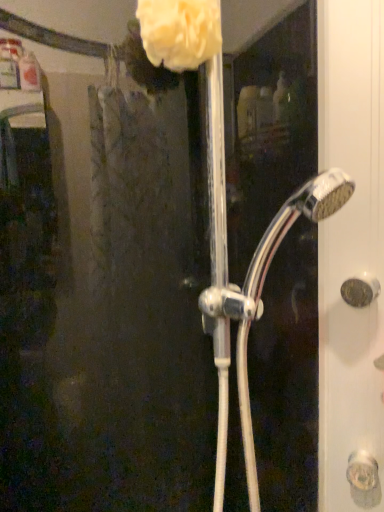
Question: Considering the positions of white fluffy sponge at upper center and matte gold door handle at right in the image, is white fluffy sponge at upper center wider or thinner than matte gold door handle at right?

Choices:
 (A) thin
 (B) wide

Answer: (B)

Question: Is white fluffy sponge at upper center spatially inside matte gold door handle at right, or outside of it?

Choices:
 (A) inside
 (B) outside

Answer: (B)

Question: Considering the real-world distances, which object is farthest from the white fluffy sponge at upper center?

Choices:
 (A) chrome metallic showerhead at center
 (B) matte gold door handle at right

Answer: (B)

Question: Based on their relative distances, which object is nearer to the white fluffy sponge at upper center?

Choices:
 (A) matte gold door handle at right
 (B) chrome metallic showerhead at center

Answer: (B)